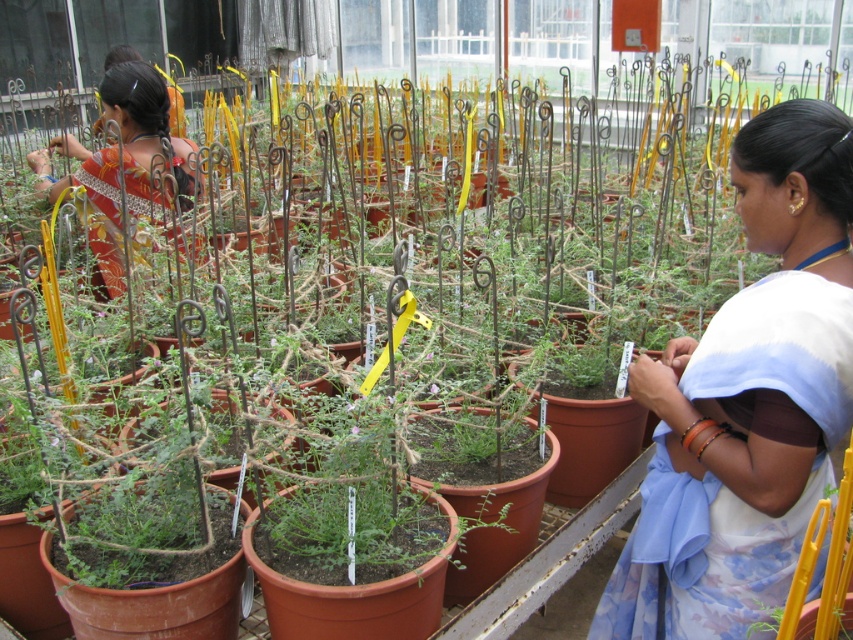
You are standing in the greenhouse and notice two people wearing sarees. The white cotton saree at center and the matte orange saree at left. Which saree is positioned lower in the image?

The white cotton saree at center is below the matte orange saree at left, so the white cotton saree at center is positioned lower in the image.

You are a visitor in the greenhouse and notice two people wearing sarees. The woman in the white cotton saree at center is inspecting plants, and the other woman in the matte orange saree at left is nearby. Which saree is taller?

The white cotton saree at center is taller than the matte orange saree at left.

From the picture: You are a visitor in the greenhouse and see two people wearing sarees. The white cotton saree at center and the matte orange saree at left. Which saree is positioned more to the right side of the image?

The white cotton saree at center is positioned more to the right side of the image compared to the matte orange saree at left.